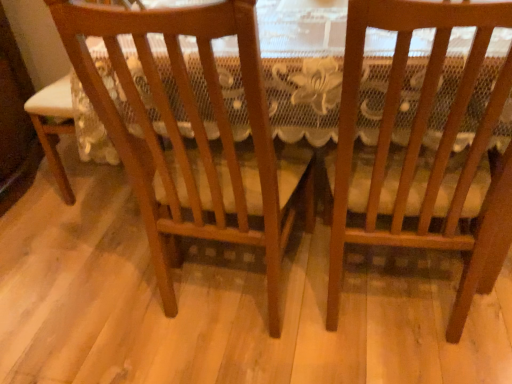
Question: Should I look upward or downward to see wooden chair at center, the 2th chair when ordered from left to right?

Choices:
 (A) up
 (B) down

Answer: (A)

Question: Should I look upward or downward to see wooden chair at center, arranged as the 2th chair when viewed from the right?

Choices:
 (A) down
 (B) up

Answer: (B)

Question: Would you say wooden chair at center, the 1th chair from the right, is outside wooden chair at center, arranged as the 2th chair when viewed from the right?

Choices:
 (A) yes
 (B) no

Answer: (A)

Question: Can you confirm if wooden chair at center, the 1th chair from the right, is bigger than wooden chair at center, the first chair in the left-to-right sequence?

Choices:
 (A) no
 (B) yes

Answer: (A)

Question: From a real-world perspective, is wooden chair at center, the 1th chair from the right, located higher than wooden chair at center, arranged as the 2th chair when viewed from the right?

Choices:
 (A) no
 (B) yes

Answer: (A)

Question: Is wooden chair at center, the 1th chair from the right, positioned with its back to wooden chair at center, arranged as the 2th chair when viewed from the right?

Choices:
 (A) yes
 (B) no

Answer: (B)

Question: Is wooden chair at center, the 1th chair from the right, far away from wooden chair at center, the first chair in the left-to-right sequence?

Choices:
 (A) yes
 (B) no

Answer: (B)

Question: From a real-world perspective, is wooden chair at center, the 1th chair from the right, located beneath wooden chair at center, the first chair in the left-to-right sequence?

Choices:
 (A) yes
 (B) no

Answer: (A)

Question: Does wooden chair at center, the first chair in the left-to-right sequence, have a lesser height compared to wooden chair at center, the 1th chair from the right?

Choices:
 (A) no
 (B) yes

Answer: (A)

Question: From a real-world perspective, does wooden chair at center, the first chair in the left-to-right sequence, sit lower than wooden chair at center, the 2th chair when ordered from left to right?

Choices:
 (A) no
 (B) yes

Answer: (A)

Question: From a real-world perspective, is wooden chair at center, arranged as the 2th chair when viewed from the right, over wooden chair at center, the 1th chair from the right?

Choices:
 (A) yes
 (B) no

Answer: (A)

Question: Can you confirm if wooden chair at center, arranged as the 2th chair when viewed from the right, is bigger than wooden chair at center, the 1th chair from the right?

Choices:
 (A) no
 (B) yes

Answer: (B)

Question: Could you tell me if wooden chair at center, arranged as the 2th chair when viewed from the right, is turned towards wooden chair at center, the 2th chair when ordered from left to right?

Choices:
 (A) yes
 (B) no

Answer: (B)

Question: Is the surface of wooden chair at center, arranged as the 2th chair when viewed from the right, in direct contact with wooden chair at center, the 2th chair when ordered from left to right?

Choices:
 (A) no
 (B) yes

Answer: (A)

Question: Visually, is wooden chair at center, the 1th chair from the right, positioned to the left or to the right of wooden chair at center, arranged as the 2th chair when viewed from the right?

Choices:
 (A) left
 (B) right

Answer: (B)